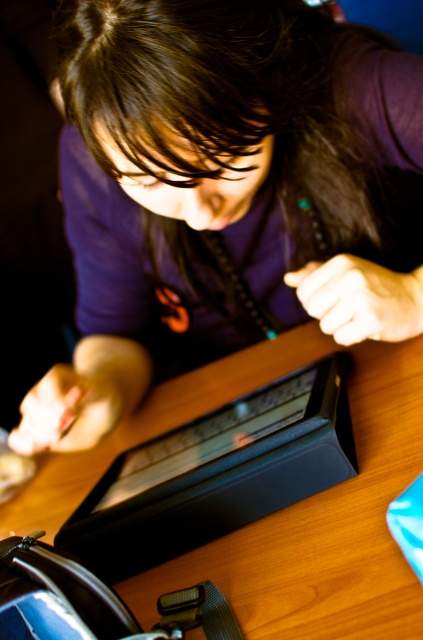
You are an observer looking at the scene. You see the purple matte shirt at upper center and the wooden table at center. Which object is located to the left of the other?

The purple matte shirt at upper center is positioned on the left side of wooden table at center.

You are a photographer adjusting your camera to capture the scene. The camera lens is currently focused on the tablet. To ensure the purple matte shirt at upper center is in focus, should you adjust the focus closer or farther from the camera?

The purple matte shirt at upper center is located at point (219, 188), which is closer to the camera than the tablet. Therefore, to focus on the shirt, you should adjust the focus closer to the camera.